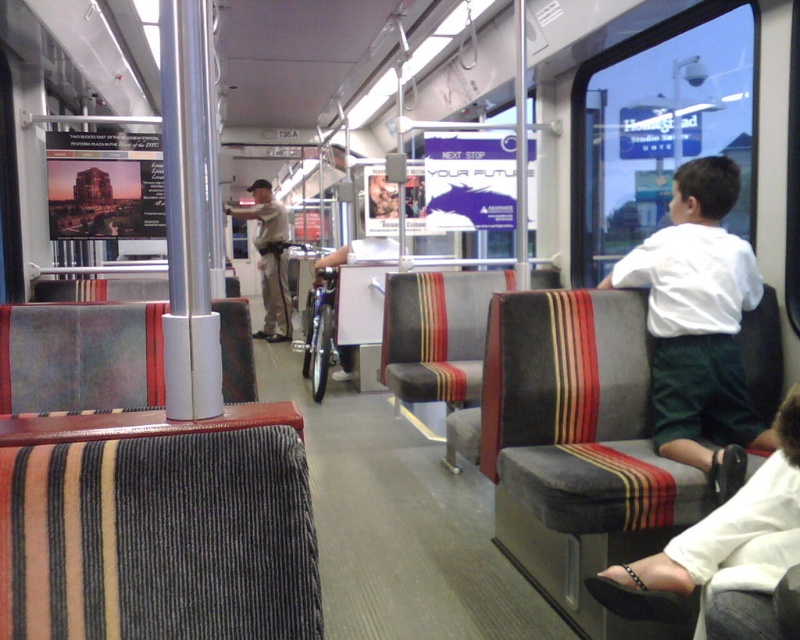
You are a passenger on this train and you want to put your white cotton shirt at right into your bag which is near your white fabric shoe at lower right. Can you reach it without moving from your seat?

The white cotton shirt at right is to the right of the white fabric shoe at lower right, so you can reach the white cotton shirt at right from your current position near the white fabric shoe at lower right.

You are a passenger on this public transit vehicle and you see a white fabric shoe at lower right and a khaki uniform at center. Which object is positioned more to the right side of the vehicle?

The white fabric shoe at lower right is positioned more to the right side of the vehicle than the khaki uniform at center.

You are standing in the public transit vehicle and want to place a small backpack on the seat nearest to the white cotton shirt at right. Is there enough space on the seat for the backpack?

The white cotton shirt at right is located at point (698,324). Since the seats are arranged in pairs along the sides with a central aisle, the nearest seat to the white cotton shirt at right likely has sufficient space for a small backpack unless occupied. However, without specific seat dimensions, it is uncertain. Please check the seat availability.